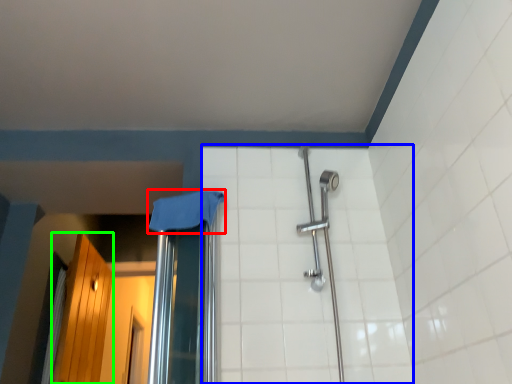
Question: Based on their relative distances, which object is farther from cloth (highlighted by a red box)? Choose from ceramic tile (highlighted by a blue box) and screen door (highlighted by a green box).

Choices:
 (A) ceramic tile
 (B) screen door

Answer: (B)